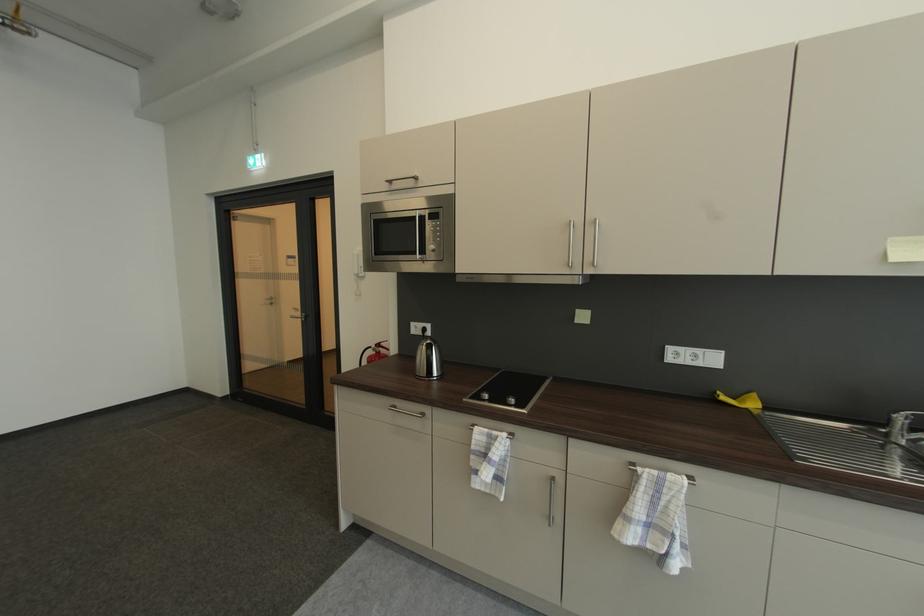
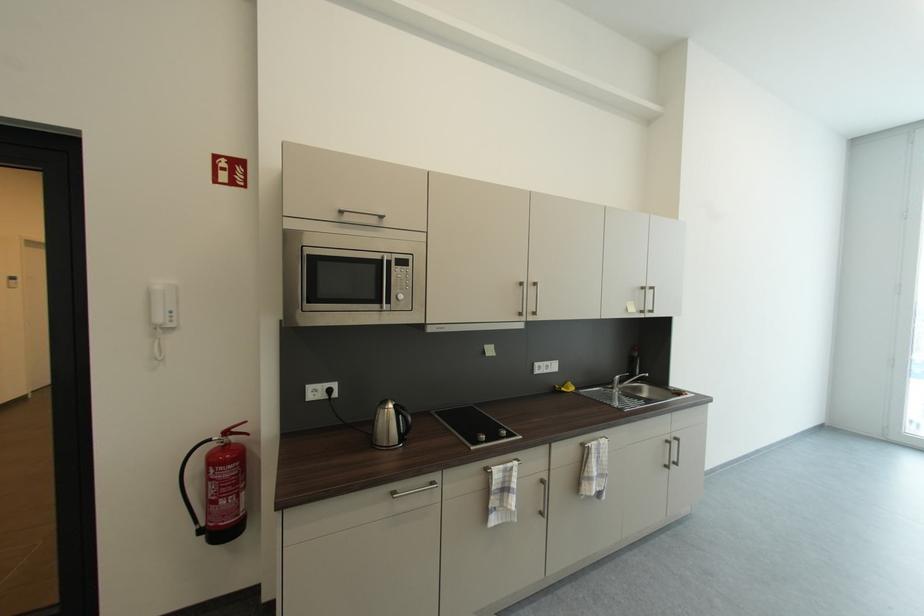
Find the pixel in the second image that matches pixel 896 422 in the first image.

(618, 383)